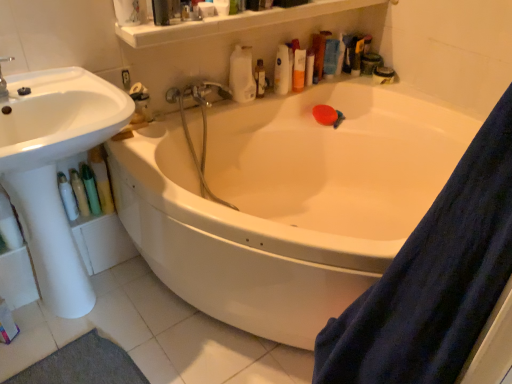
Question: Is brushed metal faucet at upper left taller than white glossy bathtub at center?

Choices:
 (A) no
 (B) yes

Answer: (A)

Question: Is brushed metal faucet at upper left to the right of white glossy bathtub at center from the viewer's perspective?

Choices:
 (A) yes
 (B) no

Answer: (B)

Question: From the image's perspective, is brushed metal faucet at upper left on white glossy bathtub at center?

Choices:
 (A) no
 (B) yes

Answer: (B)

Question: Is brushed metal faucet at upper left shorter than white glossy bathtub at center?

Choices:
 (A) yes
 (B) no

Answer: (A)

Question: Is white glossy bathtub at center inside brushed metal faucet at upper left?

Choices:
 (A) no
 (B) yes

Answer: (A)

Question: From a real-world perspective, is white glossy bathtub at center positioned above or below brushed metal faucet at upper left?

Choices:
 (A) below
 (B) above

Answer: (A)

Question: Considering the positions of point (365, 208) and point (6, 82), is point (365, 208) closer or farther from the camera than point (6, 82)?

Choices:
 (A) closer
 (B) farther

Answer: (B)

Question: In the image, is white glossy bathtub at center positioned in front of or behind brushed metal faucet at upper left?

Choices:
 (A) behind
 (B) front

Answer: (B)

Question: From the image's perspective, is white glossy bathtub at center above or below brushed metal faucet at upper left?

Choices:
 (A) below
 (B) above

Answer: (A)

Question: Is point (260, 74) positioned closer to the camera than point (146, 34)?

Choices:
 (A) farther
 (B) closer

Answer: (A)

Question: Would you say translucent plastic bottle at upper center, which is the second toiletry from back to front, is to the left or to the right of translucent plastic bottles at upper center in the picture?

Choices:
 (A) right
 (B) left

Answer: (B)

Question: In terms of size, does translucent plastic bottle at upper center, which is the 4th toiletry from bottom to top, appear bigger or smaller than translucent plastic bottles at upper center?

Choices:
 (A) big
 (B) small

Answer: (B)

Question: In terms of height, does translucent plastic bottle at upper center, the second toiletry positioned from the right, look taller or shorter compared to translucent plastic bottles at upper center?

Choices:
 (A) tall
 (B) short

Answer: (A)

Question: From the image's perspective, is translucent plastic bottles at upper center positioned above or below white glossy bathtub at center?

Choices:
 (A) above
 (B) below

Answer: (A)

Question: Is translucent plastic bottles at upper center taller or shorter than white glossy bathtub at center?

Choices:
 (A) tall
 (B) short

Answer: (B)